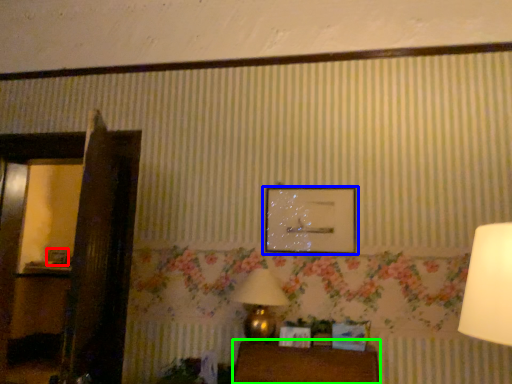
Question: Which object is the farthest from picture frame (highlighted by a red box)? Choose among these: picture frame (highlighted by a blue box) or furniture (highlighted by a green box).

Choices:
 (A) picture frame
 (B) furniture

Answer: (B)